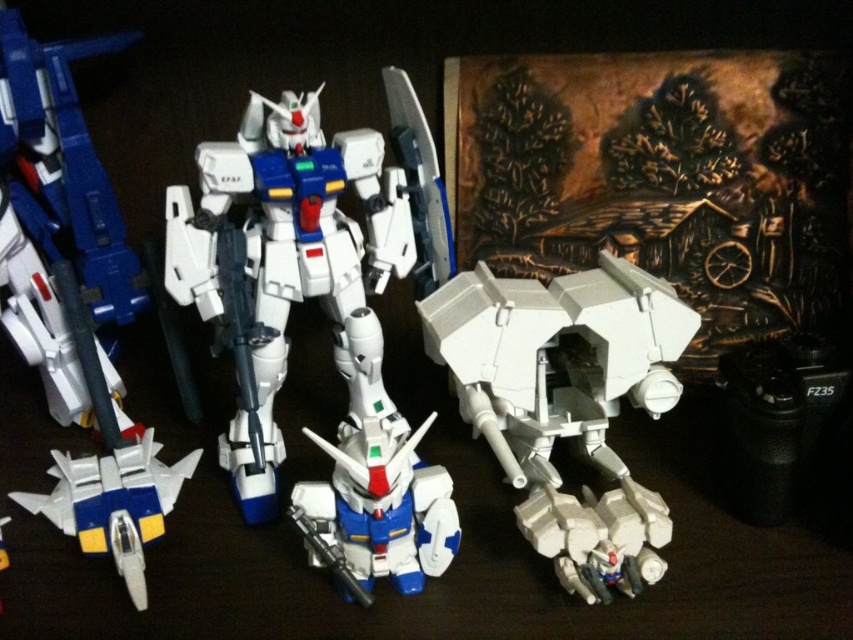
You are a collector who wants to place a new model on the display surface. You have a small statue that is 10 cm tall. The white plastic robot at center is 20 cm tall and the white plastic jet at lower left is 15 cm tall. Which existing model should you place the statue next to so it doesn

The white plastic jet at lower left is shorter than the white plastic robot at center, so placing the 10 cm statue next to the white plastic jet at lower left would ensure it is not overshadowed by the taller robot.

You are a collector examining the Gundam models displayed on the dark surface. You notice two points marked on the image, one at coordinate point (450, 248) and another at point (151, 454). Which point is closer to you as you look at the display?

Point (450, 248) is closer to you than point (151, 454) because it is further to the viewer according to the description.